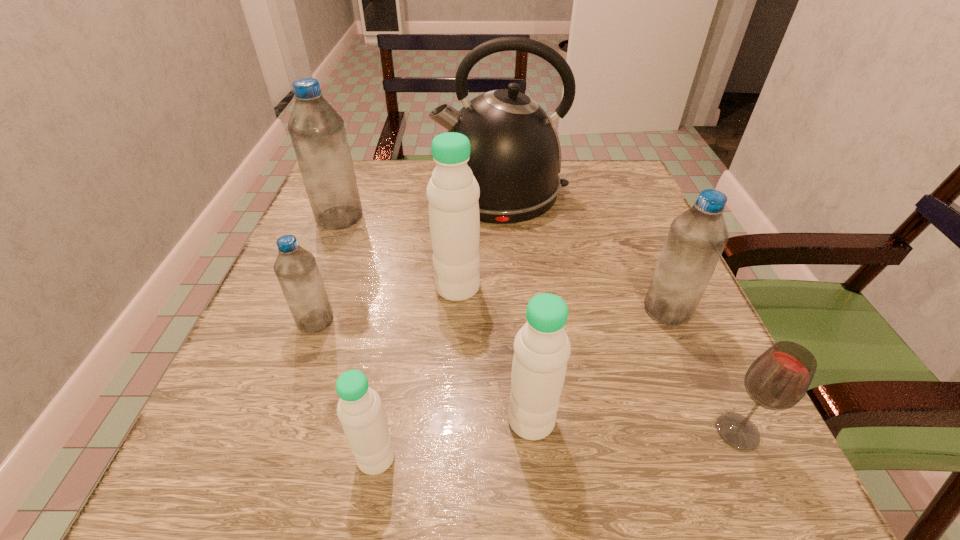
The width and height of the screenshot is (960, 540). What are the coordinates of `the third object from left to right` in the screenshot? It's located at (359, 409).

The width and height of the screenshot is (960, 540). In order to click on the fourth water bottle from right to left in this screenshot , I will do `click(359, 409)`.

I want to click on glass drink container, so click(x=778, y=379).

This screenshot has width=960, height=540. What are the coordinates of `vacant region located 0.060m on the spout of the kettle` in the screenshot? It's located at (410, 191).

What are the coordinates of `free region located on the spout of the kettle` in the screenshot? It's located at (361, 191).

At what (x,y) coordinates should I click in order to perform the action: click on free space located on the spout of the kettle. Please return your answer as a coordinate pair (x, y). This screenshot has width=960, height=540. Looking at the image, I should click on (348, 191).

The width and height of the screenshot is (960, 540). Identify the location of vacant space located on the right of the farthest blue water bottle. (412, 217).

In order to click on free space located on the right of the second white water bottle from right to left in this screenshot , I will do (539, 287).

This screenshot has height=540, width=960. Identify the location of vacant region located 0.190m on the front of the rightmost water bottle. (718, 430).

Identify the location of free region located on the left of the second biggest white water bottle. (439, 420).